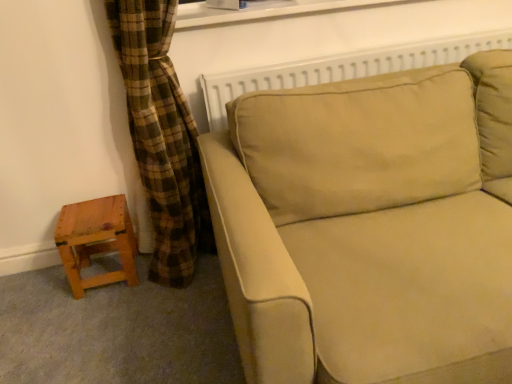
Find the location of `blank space situated above wooden stool at lower left (from a real-world perspective)`. blank space situated above wooden stool at lower left (from a real-world perspective) is located at coordinates (84, 209).